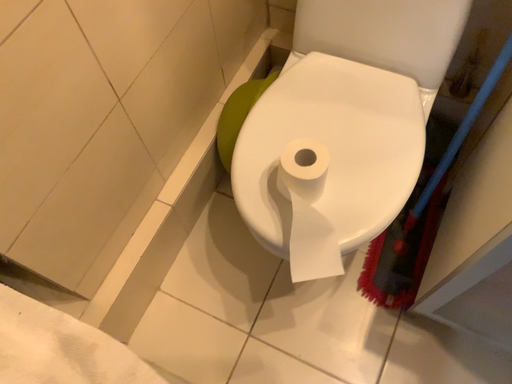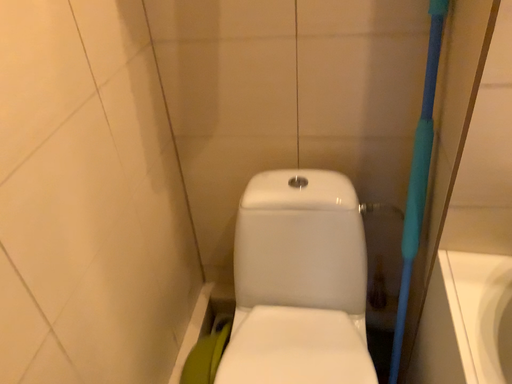
Question: Which way did the camera rotate in the video?

Choices:
 (A) rotated left
 (B) rotated right

Answer: (B)